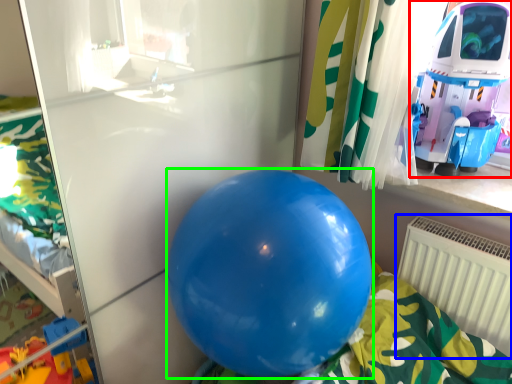
Question: Which is farther away from toy (highlighted by a red box)? radiator (highlighted by a blue box) or balloon (highlighted by a green box)?

Choices:
 (A) radiator
 (B) balloon

Answer: (B)